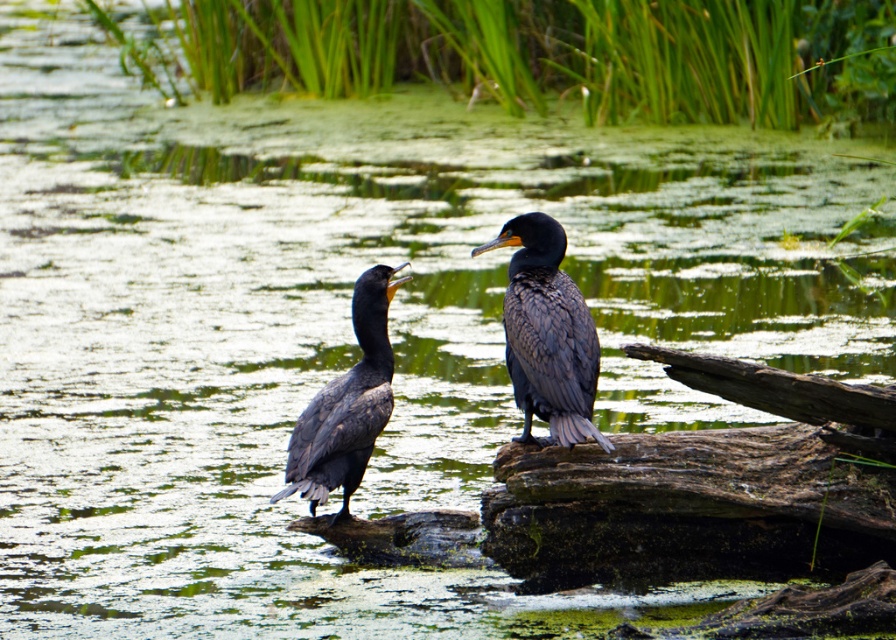
Question: Which point is farther from the camera taking this photo?

Choices:
 (A) (334, 465)
 (B) (513, 260)

Answer: (A)

Question: Does shiny black cormorant at center have a smaller size compared to dark gray feathers at center?

Choices:
 (A) no
 (B) yes

Answer: (A)

Question: Which point is closer to the camera taking this photo?

Choices:
 (A) (527, 400)
 (B) (329, 452)

Answer: (A)

Question: Is shiny black cormorant at center above dark gray feathers at center?

Choices:
 (A) yes
 (B) no

Answer: (A)

Question: Can you confirm if shiny black cormorant at center is positioned below dark gray feathers at center?

Choices:
 (A) no
 (B) yes

Answer: (A)